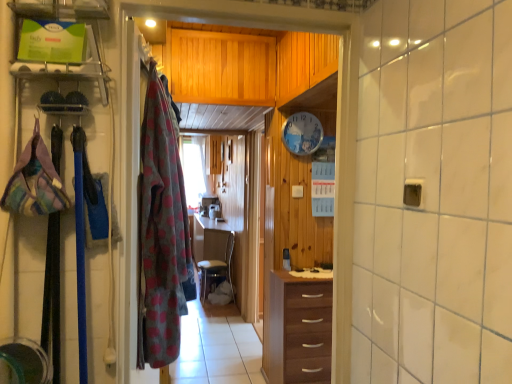
Question: From the image's perspective, is brown wood chest of drawers at center over wooden drawer at center?

Choices:
 (A) no
 (B) yes

Answer: (B)

Question: Considering the relative sizes of brown wood chest of drawers at center and wooden drawer at center in the image provided, is brown wood chest of drawers at center taller than wooden drawer at center?

Choices:
 (A) yes
 (B) no

Answer: (A)

Question: Does brown wood chest of drawers at center contain wooden drawer at center?

Choices:
 (A) no
 (B) yes

Answer: (A)

Question: Does brown wood chest of drawers at center appear on the right side of wooden drawer at center?

Choices:
 (A) no
 (B) yes

Answer: (B)

Question: Does brown wood chest of drawers at center have a larger size compared to wooden drawer at center?

Choices:
 (A) no
 (B) yes

Answer: (A)

Question: From a real-world perspective, is brown wood chest of drawers at center on top of wooden drawer at center?

Choices:
 (A) yes
 (B) no

Answer: (A)

Question: Can you confirm if wooden drawer at center is positioned to the right of plaid fabric bag at left, which ranks as the 2th clothing in right-to-left order?

Choices:
 (A) no
 (B) yes

Answer: (B)

Question: Is the depth of wooden drawer at center less than that of plaid fabric bag at left, positioned as the 2th clothing in back-to-front order?

Choices:
 (A) yes
 (B) no

Answer: (B)

Question: Is wooden drawer at center positioned with its back to plaid fabric bag at left, positioned as the 2th clothing in back-to-front order?

Choices:
 (A) no
 (B) yes

Answer: (A)

Question: Does wooden drawer at center have a greater height compared to plaid fabric bag at left, which is the first clothing from front to back?

Choices:
 (A) no
 (B) yes

Answer: (A)

Question: Does wooden drawer at center come behind plaid fabric bag at left, the 1th clothing from the left?

Choices:
 (A) yes
 (B) no

Answer: (A)

Question: Is wooden drawer at center at the left side of plaid fabric bag at left, which ranks as the 2th clothing in right-to-left order?

Choices:
 (A) yes
 (B) no

Answer: (B)

Question: From a real-world perspective, is brown wood chest of drawers at center physically below plaid fabric bag at left, which is the first clothing from front to back?

Choices:
 (A) no
 (B) yes

Answer: (B)